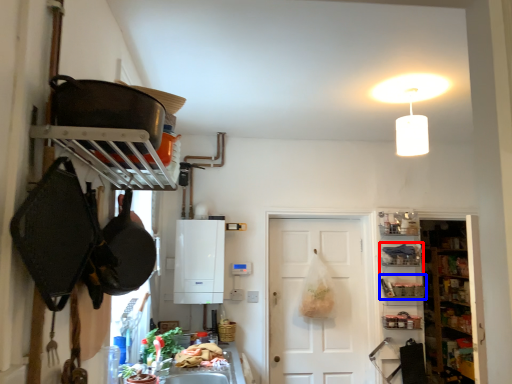
Question: Which of the following is the farthest to the observer, shelf (highlighted by a red box) or shelf (highlighted by a blue box)?

Choices:
 (A) shelf
 (B) shelf

Answer: (A)